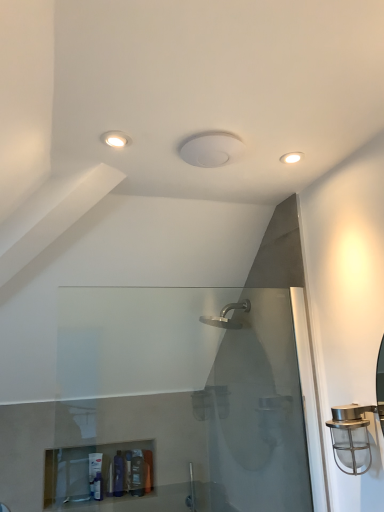
Question: Is translucent plastic bottle at lower center, the first toiletry from the right, in front of or behind metallic cage at right in the image?

Choices:
 (A) behind
 (B) front

Answer: (A)

Question: Would you say translucent plastic bottle at lower center, the first toiletry from the right, is inside or outside metallic cage at right?

Choices:
 (A) inside
 (B) outside

Answer: (B)

Question: Considering the real-world distances, which object is closest to the matte white recessed light at upper left, which is the second light fixture from right to left?

Choices:
 (A) translucent plastic tube at lower center, the second toiletry positioned from the left
 (B) translucent plastic bottle at lower center, the first toiletry from the right
 (C) metallic cage at right
 (D) translucent plastic bottle at lower left, the 1th toiletry when ordered from left to right
 (E) white matte light fixture at upper right, which appears as the 2th light fixture when viewed from the left

Answer: (E)

Question: Which object is the farthest from the translucent plastic bottle at lower left, the 1th toiletry when ordered from left to right?

Choices:
 (A) translucent plastic tube at lower center, the second toiletry positioned from the left
 (B) translucent plastic bottle at lower center, the first toiletry from the right
 (C) white matte light fixture at upper right, arranged as the 2th light fixture when viewed from the front
 (D) matte white recessed light at upper left, which is the 2th light fixture in back-to-front order
 (E) metallic cage at right

Answer: (C)